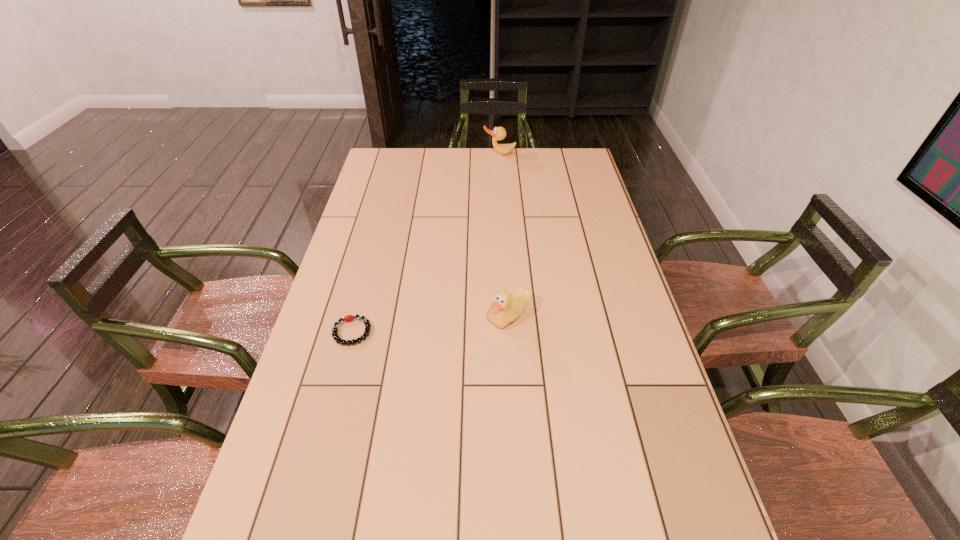
What are the coordinates of `the farthest object` in the screenshot? It's located at (499, 133).

The image size is (960, 540). I want to click on the nearer duck, so click(507, 307).

Where is `bracelet`? This screenshot has height=540, width=960. bracelet is located at coordinates (348, 318).

What are the coordinates of `the leftmost object` in the screenshot? It's located at (348, 318).

Find the location of `vacant space located on the beak of the farthest object`. vacant space located on the beak of the farthest object is located at coordinates (501, 183).

I want to click on free spot located at the beak of the nearer duck, so click(430, 316).

I want to click on free space located 0.140m at the beak of the nearer duck, so click(437, 316).

Find the location of `free region located 0.160m at the beak of the nearer duck`. free region located 0.160m at the beak of the nearer duck is located at coordinates (430, 316).

Where is `vacant area situated on the front of the shortest object`? vacant area situated on the front of the shortest object is located at coordinates (304, 510).

Identify the location of object located at the far edge. The height and width of the screenshot is (540, 960). (499, 133).